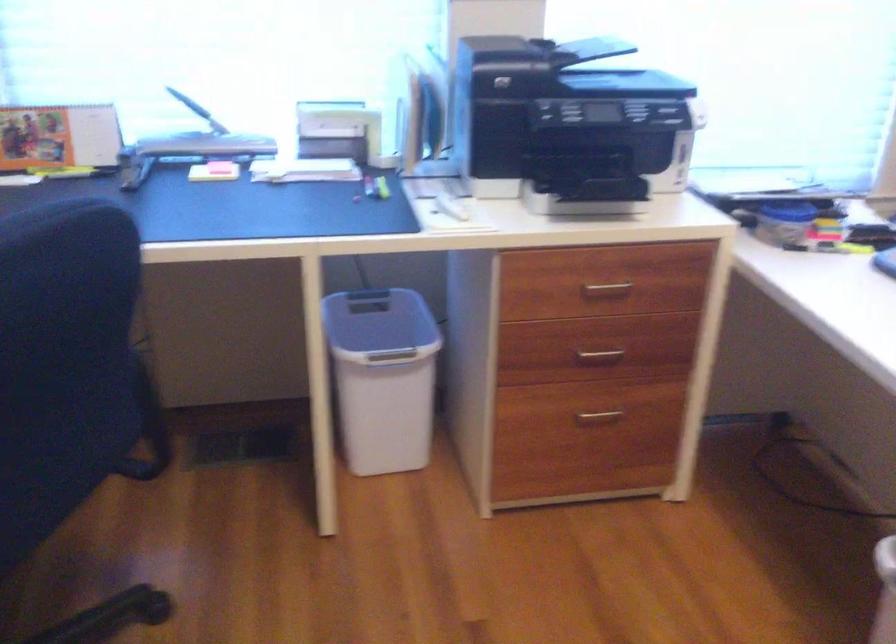
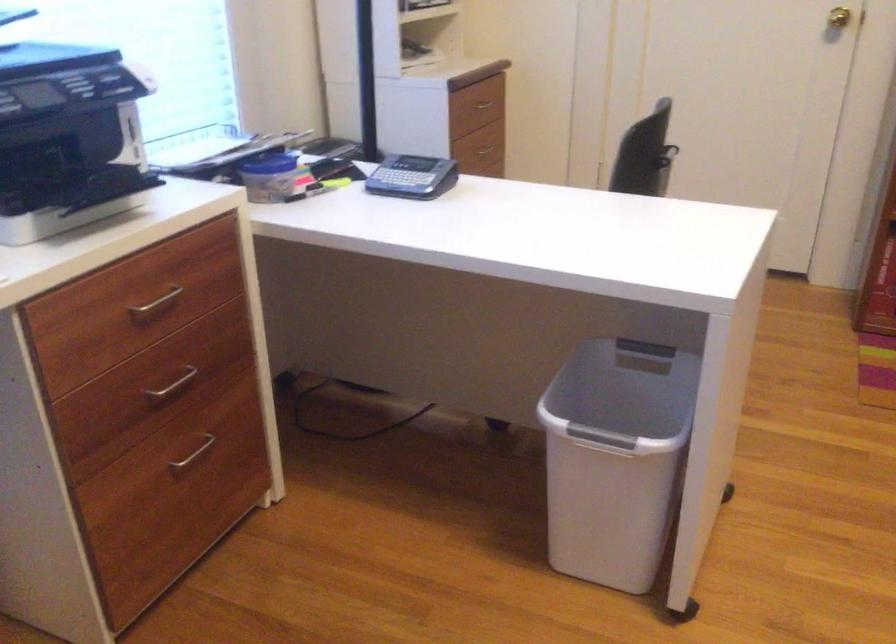
Question: Based on the continuous images, in which direction is the camera rotating? Reply with the corresponding letter.

Choices:
 (A) Left
 (B) Right
 (C) Up
 (D) Down

Answer: (B)